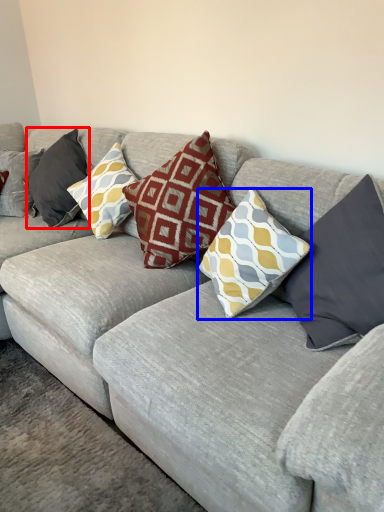
Question: Which point is closer to the camera, pillow (highlighted by a red box) or pillow (highlighted by a blue box)?

Choices:
 (A) pillow
 (B) pillow

Answer: (B)